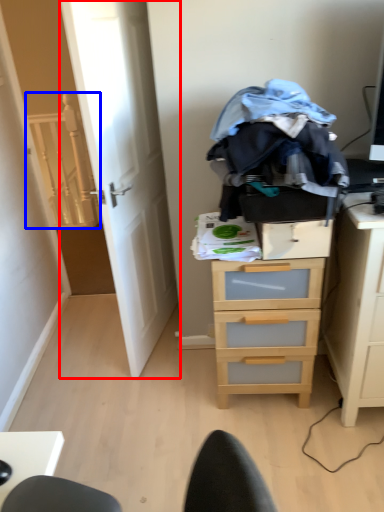
Question: Which point is further to the camera, door (highlighted by a red box) or stairwell (highlighted by a blue box)?

Choices:
 (A) door
 (B) stairwell

Answer: (B)